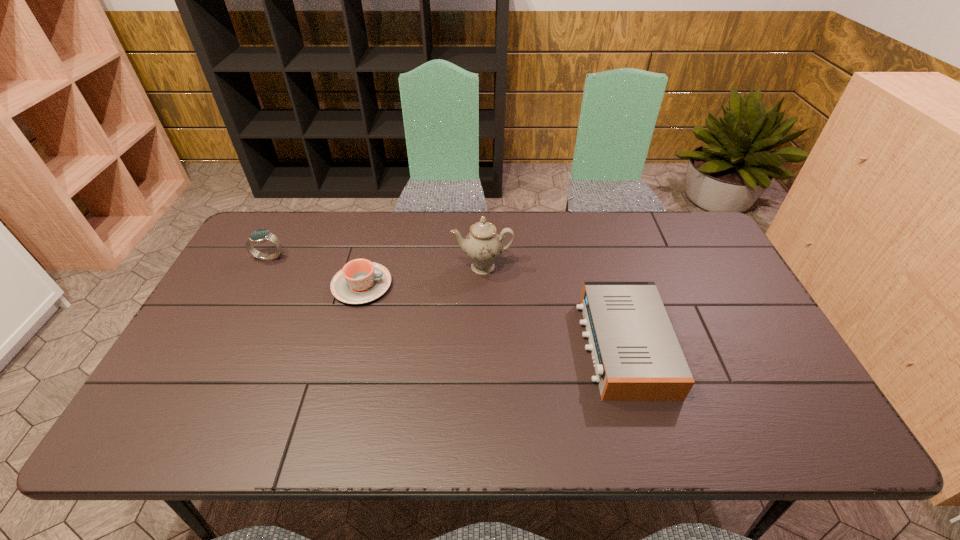
Identify the location of the tallest object. Image resolution: width=960 pixels, height=540 pixels. (483, 245).

In order to click on the taller chinaware in this screenshot , I will do `click(483, 245)`.

The width and height of the screenshot is (960, 540). I want to click on the leftmost object, so click(x=259, y=236).

Locate an element on the screen. The width and height of the screenshot is (960, 540). the second tallest object is located at coordinates click(259, 236).

Find the location of a particular element. The width and height of the screenshot is (960, 540). radio receiver is located at coordinates (637, 357).

Identify the location of the left chinaware. The height and width of the screenshot is (540, 960). (360, 281).

The image size is (960, 540). Identify the location of the second object from left to right. (360, 281).

Where is `free space located 0.380m on the spout of the taller chinaware`? The height and width of the screenshot is (540, 960). free space located 0.380m on the spout of the taller chinaware is located at coordinates (483, 390).

This screenshot has width=960, height=540. I want to click on free spot located on the front of the leftmost object, so click(x=218, y=356).

Where is `blank space located on the control panel of the radio receiver`? blank space located on the control panel of the radio receiver is located at coordinates (457, 346).